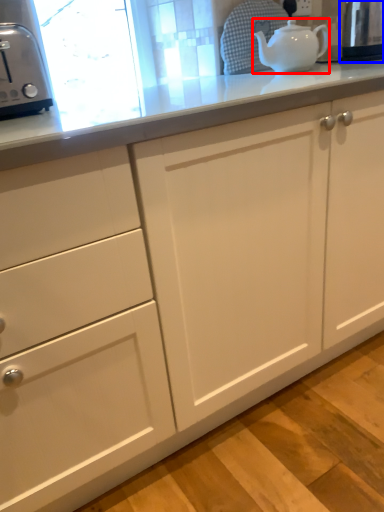
Question: Which of the following is the farthest to the observer, teapot (highlighted by a red box) or appliance (highlighted by a blue box)?

Choices:
 (A) teapot
 (B) appliance

Answer: (B)